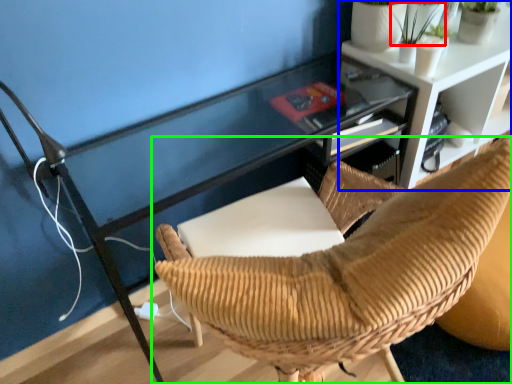
Question: Which object is positioned closest to plant (highlighted by a red box)? Select from shelf (highlighted by a blue box) and chair (highlighted by a green box).

Choices:
 (A) shelf
 (B) chair

Answer: (A)